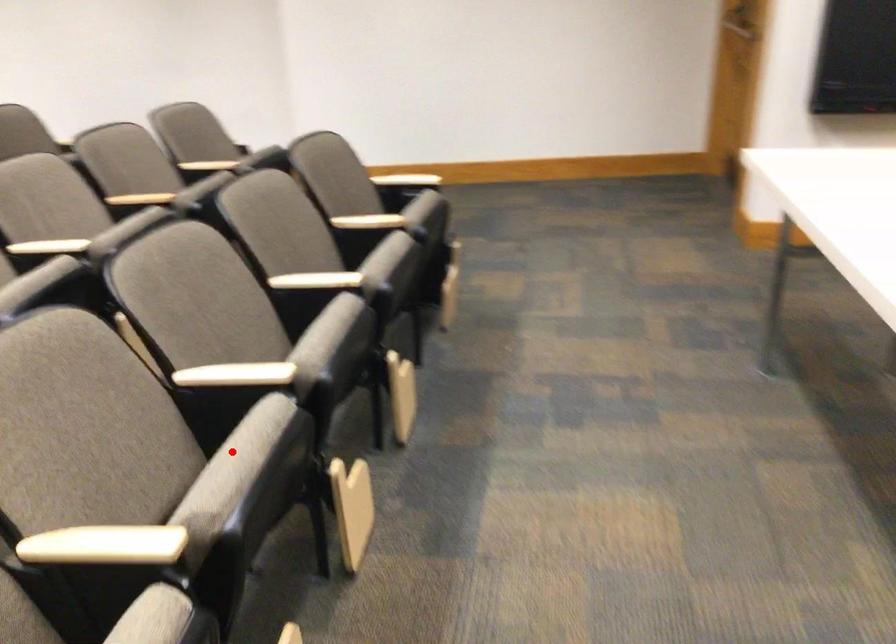
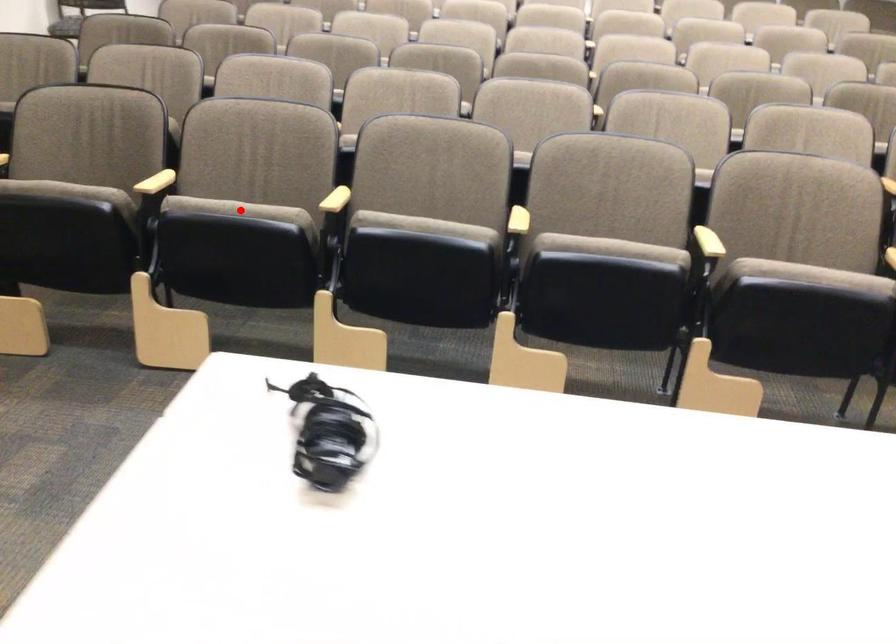
I am providing you with two images of the same scene from different viewpoints. A red point is marked on the first image and another point is marked on the second image. Are the points marked in image1 and image2 representing the same 3D position?

No